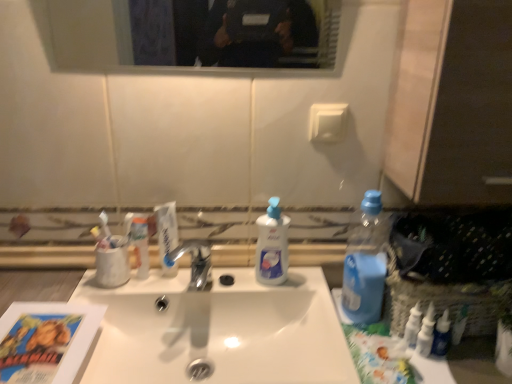
Question: Can you confirm if blue glossy bottle at lower right, placed as the first toiletry when sorted from right to left, is shorter than white glossy sink at center?

Choices:
 (A) no
 (B) yes

Answer: (A)

Question: From the image's perspective, is blue glossy bottle at lower right, placed as the first toiletry when sorted from right to left, above white glossy sink at center?

Choices:
 (A) yes
 (B) no

Answer: (A)

Question: Is white glossy sink at center at the back of blue glossy bottle at lower right, the third toiletry when ordered from left to right?

Choices:
 (A) no
 (B) yes

Answer: (A)

Question: Does blue glossy bottle at lower right, which ranks as the 3th toiletry in back-to-front order, have a greater height compared to white glossy sink at center?

Choices:
 (A) no
 (B) yes

Answer: (B)

Question: Is blue glossy bottle at lower right, which ranks as the 3th toiletry in back-to-front order, at the right side of white glossy sink at center?

Choices:
 (A) no
 (B) yes

Answer: (B)

Question: Is point (413, 334) closer or farther from the camera than point (437, 340)?

Choices:
 (A) closer
 (B) farther

Answer: (B)

Question: Is white plastic bottles at right, which is the 2th toiletry in front-to-back order, situated inside blue glossy bottle at lower right, the 1th toiletry when ordered from front to back, or outside?

Choices:
 (A) outside
 (B) inside

Answer: (A)

Question: Is white plastic bottles at right, which is the 2th toiletry in front-to-back order, bigger or smaller than blue glossy bottle at lower right, which ranks as the 3th toiletry in back-to-front order?

Choices:
 (A) big
 (B) small

Answer: (B)

Question: Looking at their shapes, would you say white plastic bottles at right, the second toiletry in the left-to-right sequence, is wider or thinner than blue glossy bottle at lower right, the 1th toiletry when ordered from front to back?

Choices:
 (A) wide
 (B) thin

Answer: (B)

Question: Is white plastic bottles at right, positioned as the 2th toiletry in right-to-left order, wider or thinner than white glossy sink at center?

Choices:
 (A) thin
 (B) wide

Answer: (A)

Question: Considering their positions, is white plastic bottles at right, which is the 2th toiletry in front-to-back order, located in front of or behind white glossy sink at center?

Choices:
 (A) behind
 (B) front

Answer: (A)

Question: Is point (408, 342) closer or farther from the camera than point (129, 344)?

Choices:
 (A) closer
 (B) farther

Answer: (A)

Question: Would you say white plastic bottles at right, the 2th toiletry in the back-to-front sequence, is inside or outside white glossy sink at center?

Choices:
 (A) inside
 (B) outside

Answer: (B)

Question: Based on their positions, is blue glossy bottle at lower right, the third toiletry when ordered from left to right, located to the left or right of clear glass mirror at upper center?

Choices:
 (A) left
 (B) right

Answer: (B)

Question: Looking at their shapes, would you say blue glossy bottle at lower right, the third toiletry when ordered from left to right, is wider or thinner than clear glass mirror at upper center?

Choices:
 (A) thin
 (B) wide

Answer: (A)